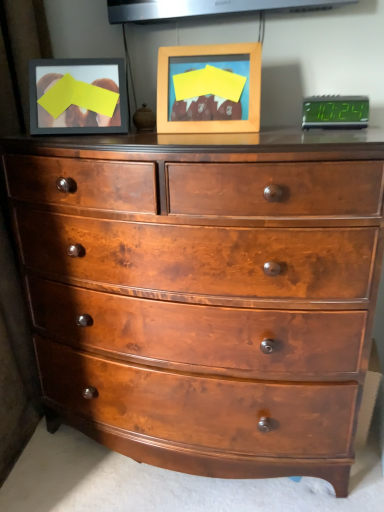
Question: Is wooden picture frame at center aimed at green digital display at upper right?

Choices:
 (A) yes
 (B) no

Answer: (B)

Question: From a real-world perspective, is wooden picture frame at center physically above green digital display at upper right?

Choices:
 (A) yes
 (B) no

Answer: (A)

Question: Is the position of wooden picture frame at center more distant than that of green digital display at upper right?

Choices:
 (A) no
 (B) yes

Answer: (A)

Question: Does wooden picture frame at center have a larger size compared to green digital display at upper right?

Choices:
 (A) yes
 (B) no

Answer: (A)

Question: Does wooden picture frame at center have a lesser height compared to green digital display at upper right?

Choices:
 (A) yes
 (B) no

Answer: (B)

Question: Relative to green digital display at upper right, is shiny brown wood chest of drawers at center in front or behind?

Choices:
 (A) front
 (B) behind

Answer: (A)

Question: From the image's perspective, is shiny brown wood chest of drawers at center above or below green digital display at upper right?

Choices:
 (A) above
 (B) below

Answer: (B)

Question: Visually, is shiny brown wood chest of drawers at center positioned to the left or to the right of green digital display at upper right?

Choices:
 (A) right
 (B) left

Answer: (B)

Question: In terms of size, does shiny brown wood chest of drawers at center appear bigger or smaller than green digital display at upper right?

Choices:
 (A) big
 (B) small

Answer: (A)

Question: Is point (243, 120) closer or farther from the camera than point (147, 388)?

Choices:
 (A) closer
 (B) farther

Answer: (A)

Question: From a real-world perspective, is wooden picture frame at center physically located above or below shiny brown wood chest of drawers at center?

Choices:
 (A) above
 (B) below

Answer: (A)

Question: Visually, is wooden picture frame at center positioned to the left or to the right of shiny brown wood chest of drawers at center?

Choices:
 (A) right
 (B) left

Answer: (A)

Question: Considering their positions, is wooden picture frame at center located in front of or behind shiny brown wood chest of drawers at center?

Choices:
 (A) behind
 (B) front

Answer: (A)

Question: Looking at the image, does green digital display at upper right seem bigger or smaller compared to shiny brown wood chest of drawers at center?

Choices:
 (A) big
 (B) small

Answer: (B)

Question: From the image's perspective, is green digital display at upper right located above or below shiny brown wood chest of drawers at center?

Choices:
 (A) above
 (B) below

Answer: (A)